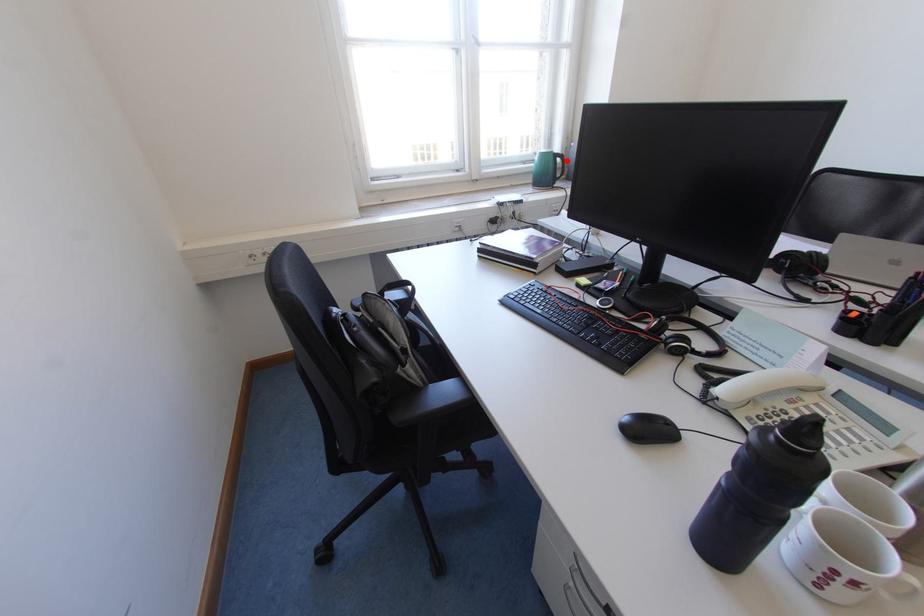
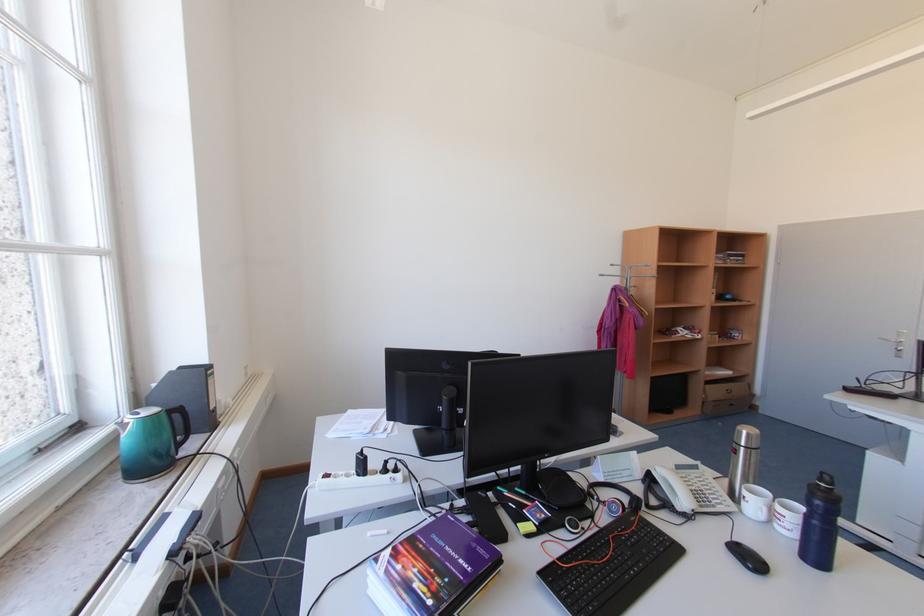
The point at the highlighted location is marked in the first image. Where is the corresponding point in the second image?

(185, 416)